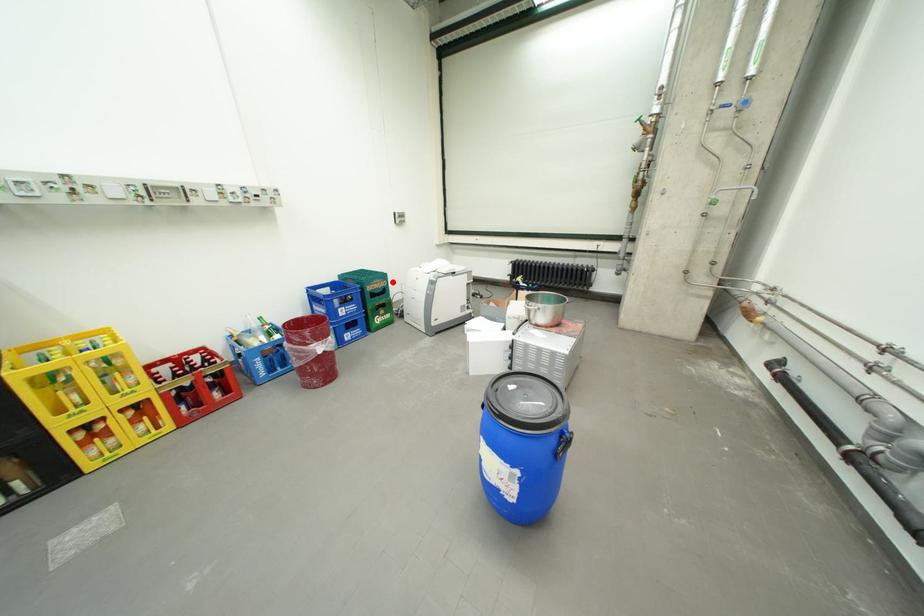
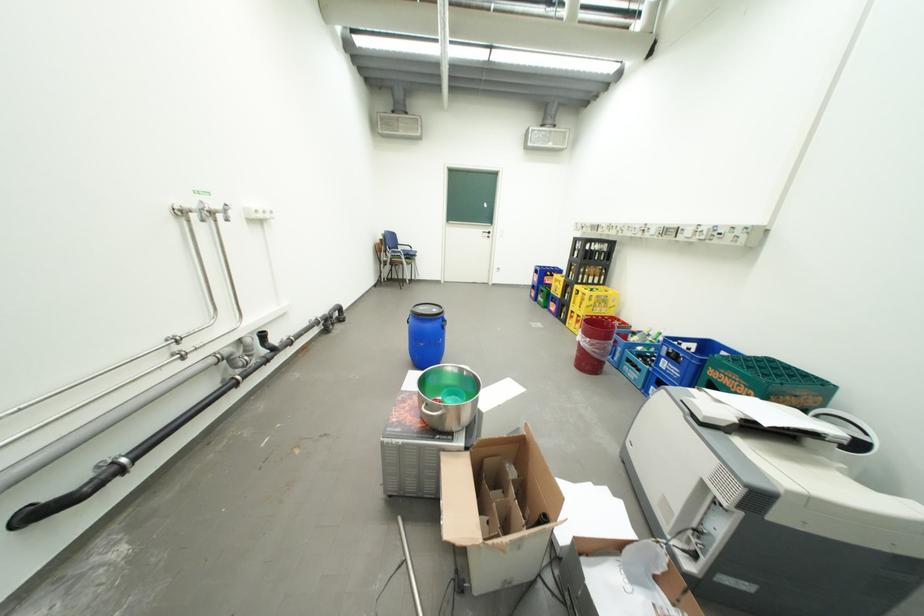
Find the pixel in the second image that matches the highlighted location in the first image.

(756, 387)